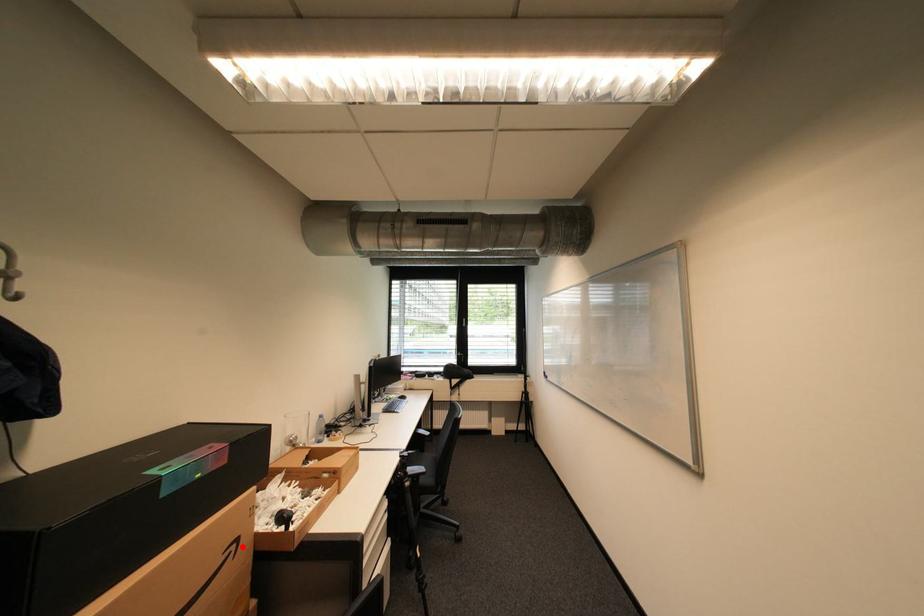
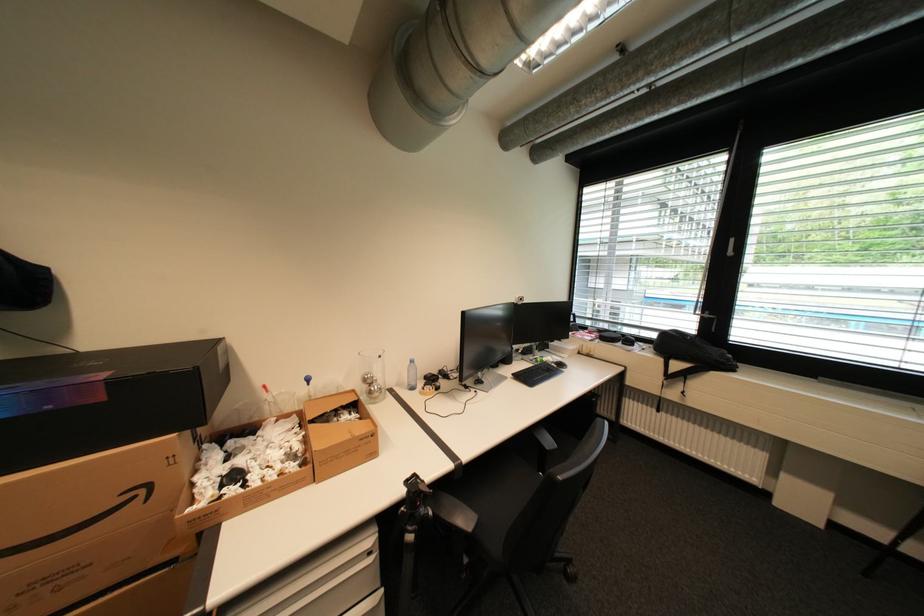
The point at the highlighted location is marked in the first image. Where is the corresponding point in the second image?

(151, 491)